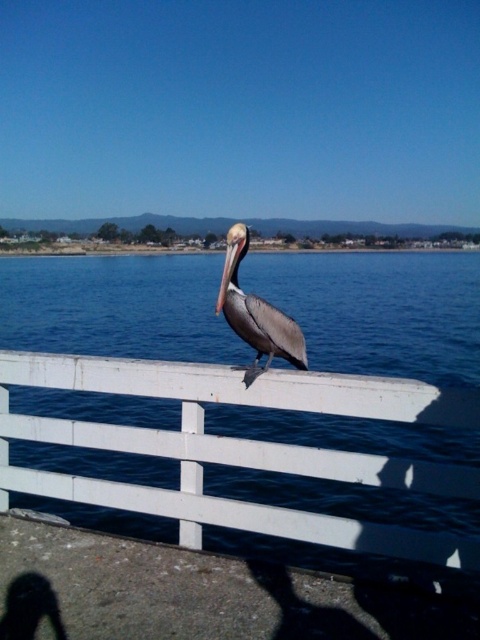
Question: Can you confirm if white painted wood at center is thinner than brown matte pelican at center?

Choices:
 (A) yes
 (B) no

Answer: (B)

Question: Does white painted wood at center appear over brown matte pelican at center?

Choices:
 (A) yes
 (B) no

Answer: (B)

Question: Can you confirm if white painted wood at center is smaller than brown matte pelican at center?

Choices:
 (A) no
 (B) yes

Answer: (A)

Question: Which point is farther to the camera?

Choices:
 (A) 284,330
 (B) 348,413

Answer: (A)